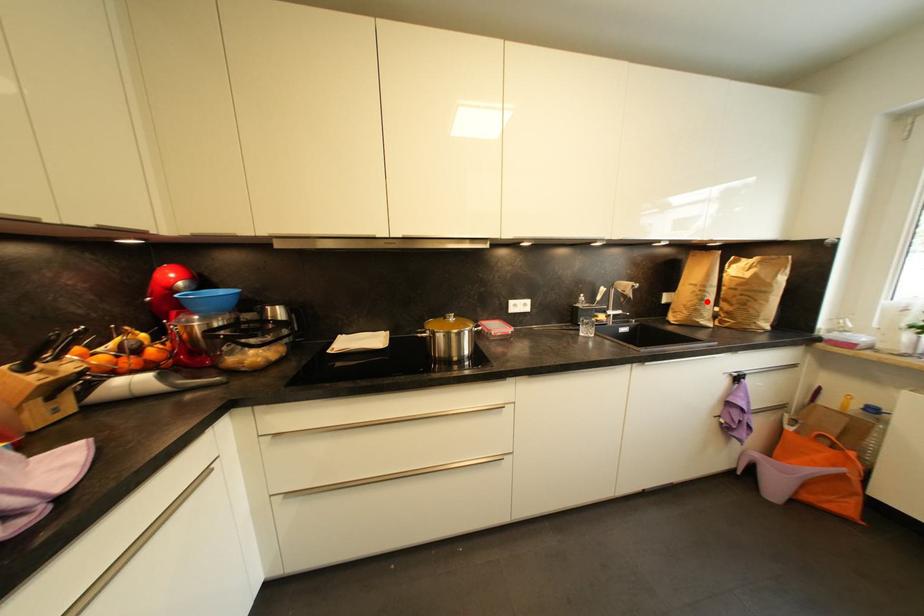
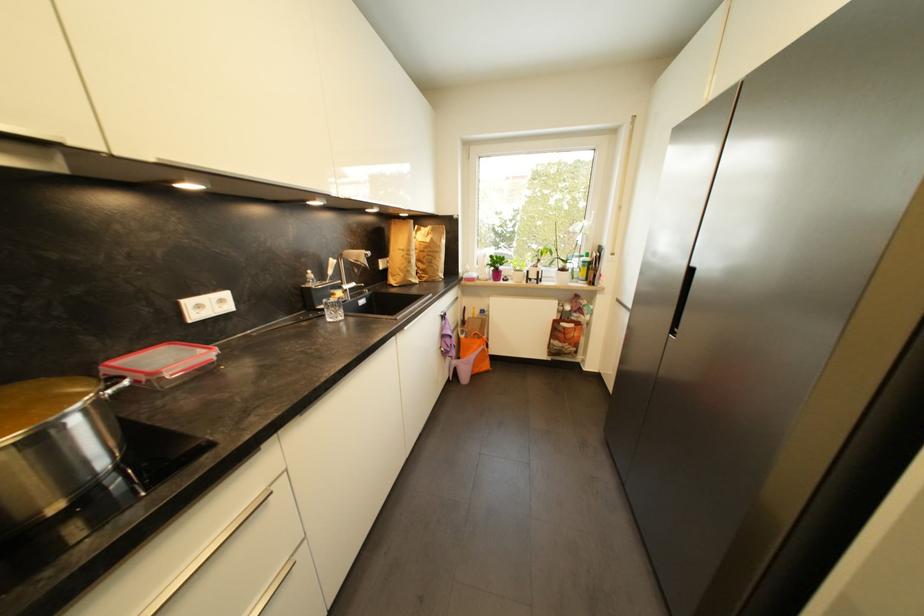
Question: I am providing you with two images of the same scene from different viewpoints. Given a red point in image1, look at the same physical point in image2. Is it:

Choices:
 (A) Closer to the viewpoint
 (B) Farther from the viewpoint

Answer: (A)